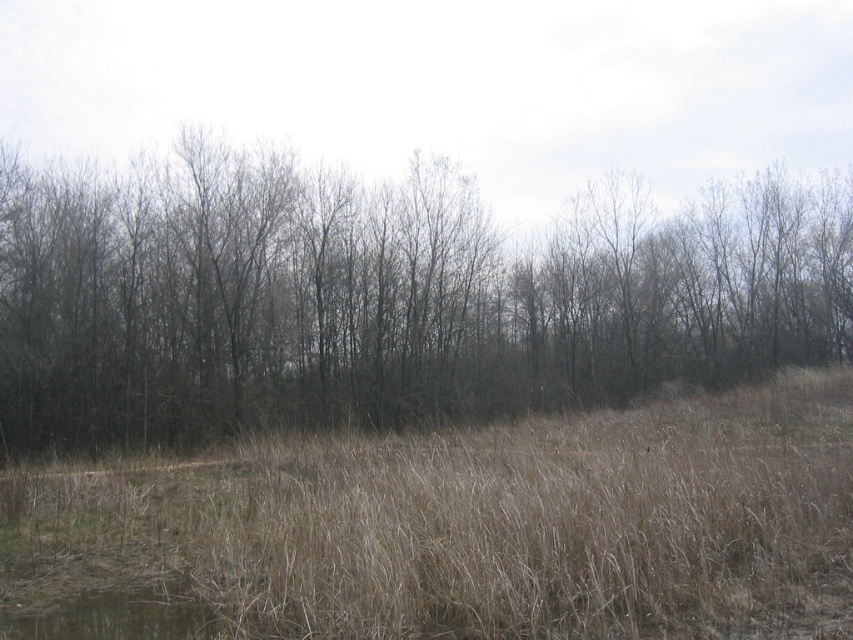
Does brown/dry grass at center come behind dry grass at center?

Yes.

Between point (193, 243) and point (492, 612), which one is positioned in front?

Point (492, 612) is more forward.

This screenshot has height=640, width=853. Identify the location of brown/dry grass at center. click(x=381, y=296).